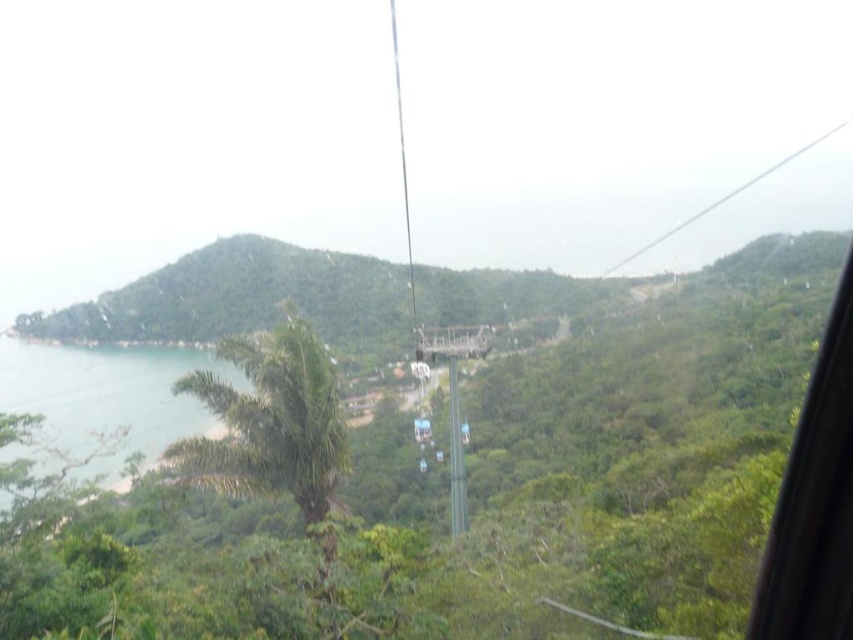
Does green leafy palm tree at center have a greater width compared to clear blue water at lower left?

No.

Is point (276, 326) positioned behind point (126, 454)?

Yes, point (276, 326) is farther from viewer.

Does point (329, 385) lie in front of point (27, 448)?

No, it is behind (27, 448).

The image size is (853, 640). Find the location of `green leafy palm tree at center`. green leafy palm tree at center is located at coordinates (270, 422).

Does point (473, 314) come farther from viewer compared to point (328, 502)?

Yes, it is behind point (328, 502).

Does green leafy mountain at center appear under green leafy palm tree at center?

No, green leafy mountain at center is not below green leafy palm tree at center.

Identify the location of green leafy mountain at center. This screenshot has height=640, width=853. (241, 298).

From the picture: Does green leafy mountain at center have a greater width compared to clear blue water at lower left?

Yes.

Does point (419, 273) lie behind point (82, 442)?

Yes.

Which is in front, point (328, 289) or point (132, 378)?

Point (132, 378)

You are a GUI agent. You are given a task and a screenshot of the screen. Output one action in this format:
    pyautogui.click(x=<x>, y=<y>)
    Task: Click on the green leafy mountain at center
    This screenshot has height=640, width=853.
    Given the screenshot: What is the action you would take?
    pyautogui.click(x=241, y=298)